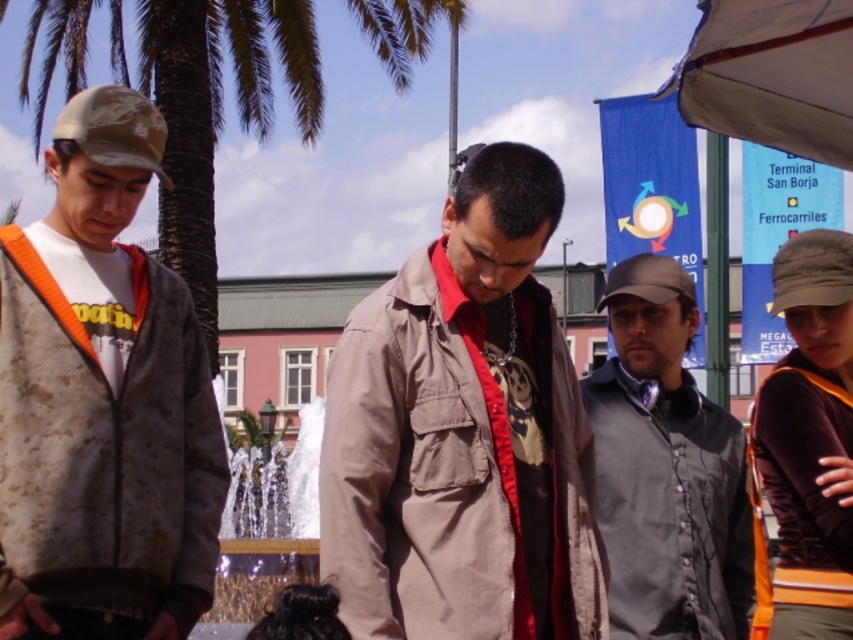
Which is in front, point (56, 148) or point (407, 20)?

Point (56, 148) is in front.

Can you confirm if camouflage jacket at left is positioned above green leafy palm tree at upper left?

Actually, camouflage jacket at left is below green leafy palm tree at upper left.

Between point (77, 124) and point (175, 202), which one is positioned in front?

Point (77, 124)

Image resolution: width=853 pixels, height=640 pixels. Find the location of `camouflage jacket at left`. camouflage jacket at left is located at coordinates (102, 401).

Who is higher up, green leafy palm tree at upper left or black fabric baseball cap at upper right?

green leafy palm tree at upper left is higher up.

Is point (84, 52) behind point (809, 260)?

Yes, point (84, 52) is behind point (809, 260).

The width and height of the screenshot is (853, 640). What are the coordinates of `green leafy palm tree at upper left` in the screenshot? It's located at (218, 109).

Between camouflage jacket at left and gray matte vest at center, which one is positioned lower?

Positioned lower is gray matte vest at center.

Is camouflage jacket at left wider than gray matte vest at center?

Yes.

Which is behind, point (16, 394) or point (701, 522)?

Point (701, 522)

Locate an element on the screen. The height and width of the screenshot is (640, 853). camouflage jacket at left is located at coordinates (102, 401).